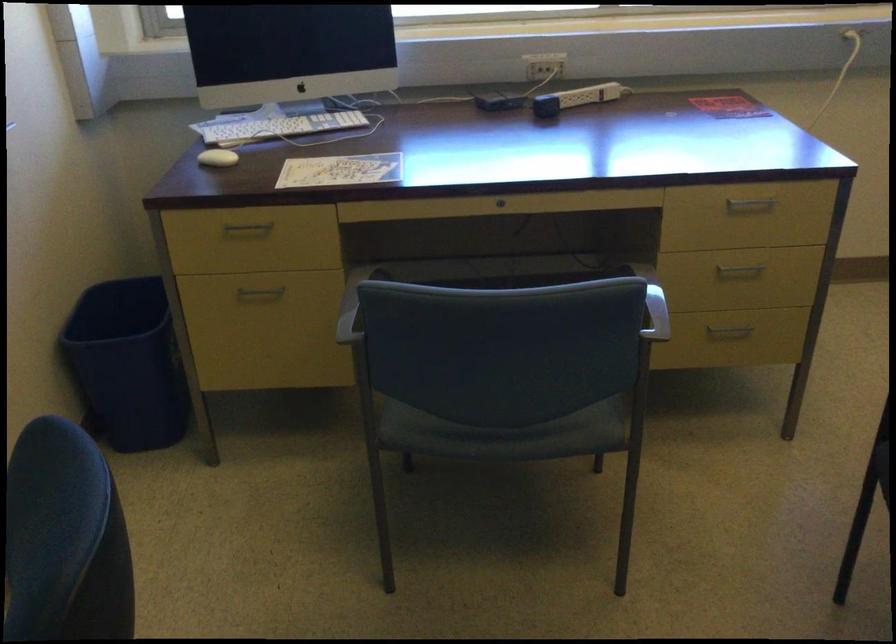
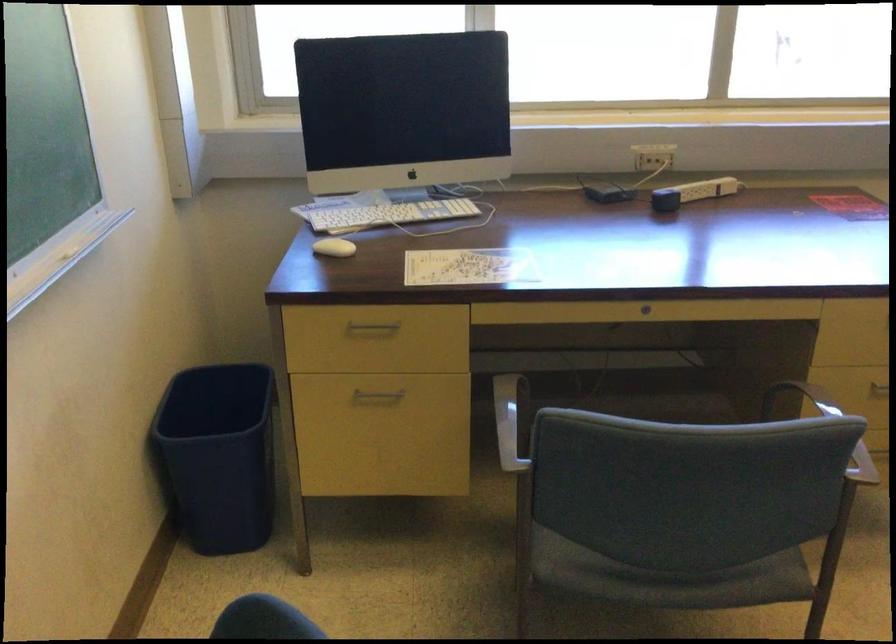
In a continuous first-person perspective shot, in which direction is the camera moving?

The cameraman moved toward left, forward.